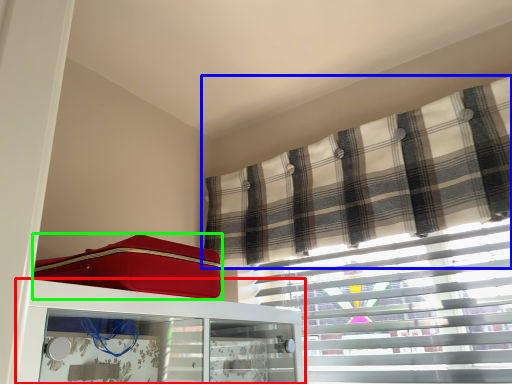
Question: Which is farther away from furniture (highlighted by a red box)? curtain (highlighted by a blue box) or suitcase (highlighted by a green box)?

Choices:
 (A) curtain
 (B) suitcase

Answer: (A)